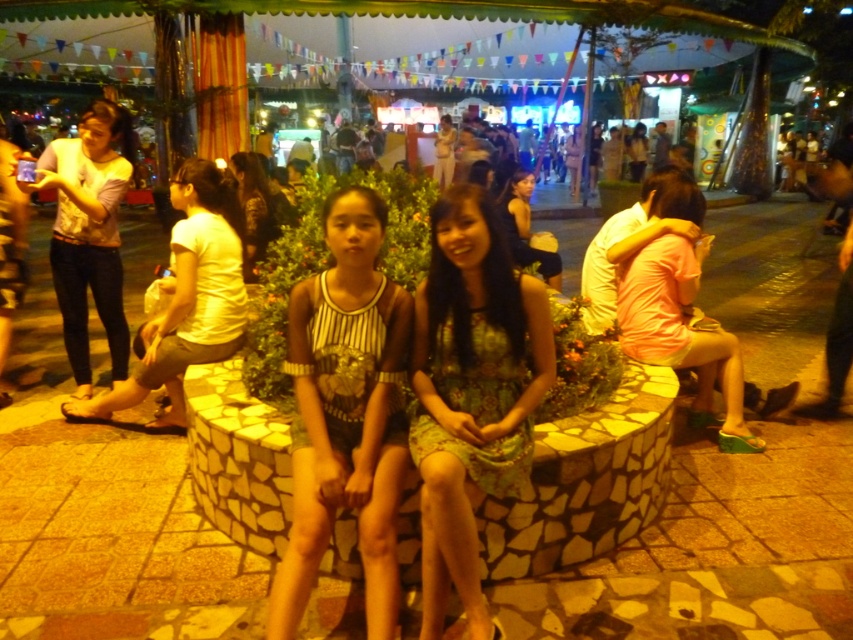
Can you confirm if matte white shirt at left is positioned to the right of matte black dress at upper right?

Incorrect, matte white shirt at left is not on the right side of matte black dress at upper right.

Which is in front, point (113, 266) or point (508, 224)?

Point (113, 266) is more forward.

Locate an element on the screen. This screenshot has width=853, height=640. matte white shirt at left is located at coordinates pyautogui.click(x=90, y=232).

Is printed fabric dress at center positioned in front of matte white shirt at left?

Yes, it is in front of matte white shirt at left.

Does point (518, 428) come farther from viewer compared to point (85, 248)?

That is False.

This screenshot has height=640, width=853. I want to click on printed fabric dress at center, so click(471, 394).

Where is `printed fabric dress at center`? printed fabric dress at center is located at coordinates (471, 394).

Is white cotton shirt at left positioned behind matte white shirt at left?

No, white cotton shirt at left is closer to the viewer.

Is white cotton shirt at left above matte white shirt at left?

Incorrect, white cotton shirt at left is not positioned above matte white shirt at left.

Between point (178, 406) and point (90, 189), which one is positioned behind?

The point (90, 189) is behind.

Image resolution: width=853 pixels, height=640 pixels. I want to click on white cotton shirt at left, so click(x=187, y=298).